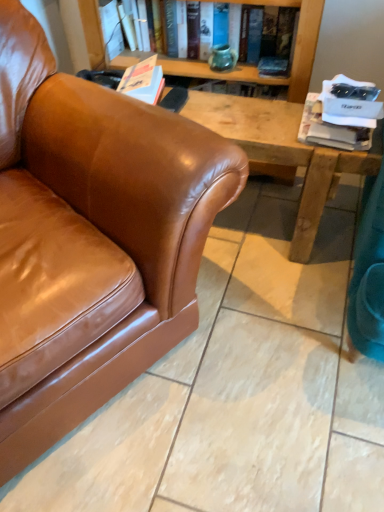
Locate an element on the screen. This screenshot has width=384, height=512. matte green vase at upper center, the second book positioned from the right is located at coordinates (212, 72).

Measure the distance between point (163, 60) and camera.

A distance of 1.74 meters exists between point (163, 60) and camera.

Locate an element on the screen. This screenshot has width=384, height=512. white paper at upper right, marked as the 2th book in a back-to-front arrangement is located at coordinates (331, 129).

Is matte green vase at upper center, positioned as the 1th book in left-to-right order, further to the viewer compared to white paper at upper right, the 1th book viewed from the right?

Yes, the depth of matte green vase at upper center, positioned as the 1th book in left-to-right order, is greater than that of white paper at upper right, the 1th book viewed from the right.

Between matte green vase at upper center, the second book positioned from the right, and white paper at upper right, marked as the 2th book in a back-to-front arrangement, which one has less height?

white paper at upper right, marked as the 2th book in a back-to-front arrangement, is shorter.

Is matte green vase at upper center, which is counted as the 2th book, starting from the front, to the right of white paper at upper right, which is counted as the first book, starting from the bottom, from the viewer's perspective?

In fact, matte green vase at upper center, which is counted as the 2th book, starting from the front, is to the left of white paper at upper right, which is counted as the first book, starting from the bottom.

Measure the distance between white paper at upper right, the 1th book viewed from the right, and matte green vase at upper center, arranged as the second book when ordered from the bottom.

They are 45.29 centimeters apart.

Can you tell me how much white paper at upper right, acting as the 2th book starting from the left, and matte green vase at upper center, the 1th book viewed from the top, differ in facing direction?

The angular difference between white paper at upper right, acting as the 2th book starting from the left, and matte green vase at upper center, the 1th book viewed from the top, is 7.15 degrees.

Can you confirm if white paper at upper right, marked as the 2th book in a back-to-front arrangement, is thinner than matte green vase at upper center, the 1th book viewed from the top?

No, white paper at upper right, marked as the 2th book in a back-to-front arrangement, is not thinner than matte green vase at upper center, the 1th book viewed from the top.

Which is closer to the camera, (330, 139) or (168, 73)?

The point (330, 139) is closer.

Can you confirm if brown leather couch at left is positioned to the right of white paper at upper right, acting as the 2th book starting from the left?

No, brown leather couch at left is not to the right of white paper at upper right, acting as the 2th book starting from the left.

Is brown leather couch at left further to camera compared to white paper at upper right, the 1th book viewed from the right?

No, brown leather couch at left is closer to the camera.

From the image's perspective, is brown leather couch at left beneath white paper at upper right, the 1th book viewed from the right?

Indeed, from the image's perspective, brown leather couch at left is shown beneath white paper at upper right, the 1th book viewed from the right.

Is brown leather couch at left taller than matte green vase at upper center, the 1th book viewed from the top?

Yes, brown leather couch at left is taller than matte green vase at upper center, the 1th book viewed from the top.

Does point (64, 202) come behind point (248, 77)?

No.

From the image's perspective, which is above, brown leather couch at left or matte green vase at upper center, marked as the 1th book in a back-to-front arrangement?

From the image's view, matte green vase at upper center, marked as the 1th book in a back-to-front arrangement, is above.

Is matte green vase at upper center, positioned as the 1th book in left-to-right order, taller than brown leather couch at left?

No, matte green vase at upper center, positioned as the 1th book in left-to-right order, is not taller than brown leather couch at left.

Is matte green vase at upper center, which is counted as the 2th book, starting from the front, to the left of brown leather couch at left from the viewer's perspective?

No, matte green vase at upper center, which is counted as the 2th book, starting from the front, is not to the left of brown leather couch at left.

Which is correct: matte green vase at upper center, which is counted as the 2th book, starting from the front, is inside brown leather couch at left, or outside of it?

matte green vase at upper center, which is counted as the 2th book, starting from the front, is located beyond the bounds of brown leather couch at left.

From the image's perspective, between white paper at upper right, which is counted as the first book, starting from the bottom, and brown leather couch at left, which one is located above?

white paper at upper right, which is counted as the first book, starting from the bottom, from the image's perspective.

Which is in front, point (298, 135) or point (220, 156)?

Positioned in front is point (220, 156).

Visually, is white paper at upper right, which is counted as the first book, starting from the bottom, positioned to the left or to the right of brown leather couch at left?

Based on their positions, white paper at upper right, which is counted as the first book, starting from the bottom, is located to the right of brown leather couch at left.

I want to click on book above the white paper at upper right, acting as the 2th book starting from the left (from a real-world perspective), so click(x=212, y=72).

The image size is (384, 512). I want to click on book that appears behind the white paper at upper right, acting as the 2th book starting from the left, so click(212, 72).

Considering their positions, is brown leather couch at left positioned closer to matte green vase at upper center, positioned as the 1th book in left-to-right order, than white paper at upper right, placed as the 2th book when sorted from top to bottom?

white paper at upper right, placed as the 2th book when sorted from top to bottom.

Estimate the real-world distances between objects in this image. Which object is further from brown leather couch at left, white paper at upper right, placed as the 2th book when sorted from top to bottom, or matte green vase at upper center, positioned as the 1th book in left-to-right order?

Based on the image, matte green vase at upper center, positioned as the 1th book in left-to-right order, appears to be further to brown leather couch at left.

Looking at the image, which one is located further to brown leather couch at left, matte green vase at upper center, the second book positioned from the right, or white paper at upper right, acting as the 2th book starting from the left?

The object further to brown leather couch at left is matte green vase at upper center, the second book positioned from the right.

From the image, which object appears to be farther from white paper at upper right, which is counted as the first book, starting from the bottom, matte green vase at upper center, the 1th book viewed from the top, or brown leather couch at left?

The object further to white paper at upper right, which is counted as the first book, starting from the bottom, is brown leather couch at left.

Considering their positions, is brown leather couch at left positioned closer to white paper at upper right, placed as the 2th book when sorted from top to bottom, than matte green vase at upper center, positioned as the 1th book in left-to-right order?

Based on the image, matte green vase at upper center, positioned as the 1th book in left-to-right order, appears to be nearer to white paper at upper right, placed as the 2th book when sorted from top to bottom.

Based on their spatial positions, is white paper at upper right, placed as the 2th book when sorted from top to bottom, or brown leather couch at left closer to matte green vase at upper center, the second book positioned from the right?

white paper at upper right, placed as the 2th book when sorted from top to bottom.

Identify the location of book between brown leather couch at left and matte green vase at upper center, marked as the 1th book in a back-to-front arrangement, in the front-back direction. The width and height of the screenshot is (384, 512). (331, 129).